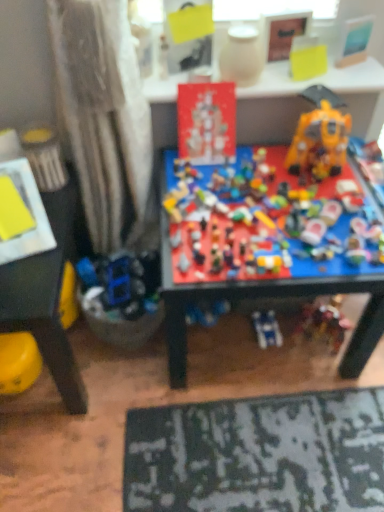
Question: Is multicolored plastic toys at center, which appears as the fourth toy when viewed from the left, to the left of yellow matte paper at upper center, positioned as the 5th toy in left-to-right order, from the viewer's perspective?

Choices:
 (A) no
 (B) yes

Answer: (B)

Question: Is multicolored plastic toys at center, which appears as the fourth toy when viewed from the left, bigger than yellow matte paper at upper center, positioned as the 5th toy in left-to-right order?

Choices:
 (A) no
 (B) yes

Answer: (B)

Question: Is the position of multicolored plastic toys at center, which appears as the fourth toy when viewed from the left, less distant than that of yellow matte paper at upper center, positioned as the 5th toy in left-to-right order?

Choices:
 (A) yes
 (B) no

Answer: (A)

Question: Is multicolored plastic toys at center, the 3th toy viewed from the right, looking in the opposite direction of yellow matte paper at upper center, positioned as the 5th toy in left-to-right order?

Choices:
 (A) no
 (B) yes

Answer: (A)

Question: Is multicolored plastic toys at center, which appears as the fourth toy when viewed from the left, positioned behind yellow matte paper at upper center, positioned as the 5th toy in left-to-right order?

Choices:
 (A) no
 (B) yes

Answer: (A)

Question: Does point (314, 48) appear closer or farther from the camera than point (360, 91)?

Choices:
 (A) farther
 (B) closer

Answer: (A)

Question: Based on their sizes in the image, would you say yellow matte paper at upper center, placed as the second toy when sorted from right to left, is bigger or smaller than red cardboard sign at upper center, which is the 1th table from right to left?

Choices:
 (A) big
 (B) small

Answer: (B)

Question: Is yellow matte paper at upper center, placed as the second toy when sorted from right to left, taller or shorter than red cardboard sign at upper center, the 2th table from the left?

Choices:
 (A) short
 (B) tall

Answer: (B)

Question: From the image's perspective, is yellow matte paper at upper center, placed as the second toy when sorted from right to left, above or below red cardboard sign at upper center, which is the 1th table from right to left?

Choices:
 (A) below
 (B) above

Answer: (B)

Question: From the image's perspective, is shiny yellow plastic robot at upper right, the 1th toy positioned from the right, located above or below yellow matte paper at upper center, positioned as the 5th toy in left-to-right order?

Choices:
 (A) below
 (B) above

Answer: (A)

Question: Based on their sizes in the image, would you say shiny yellow plastic robot at upper right, the 1th toy positioned from the right, is bigger or smaller than yellow matte paper at upper center, positioned as the 5th toy in left-to-right order?

Choices:
 (A) small
 (B) big

Answer: (B)

Question: Looking at their shapes, would you say shiny yellow plastic robot at upper right, acting as the sixth toy starting from the left, is wider or thinner than yellow matte paper at upper center, positioned as the 5th toy in left-to-right order?

Choices:
 (A) wide
 (B) thin

Answer: (A)

Question: From a real-world perspective, is shiny yellow plastic robot at upper right, the 1th toy positioned from the right, positioned above or below yellow matte paper at upper center, placed as the second toy when sorted from right to left?

Choices:
 (A) below
 (B) above

Answer: (A)

Question: Is point (69, 236) closer or farther from the camera than point (36, 162)?

Choices:
 (A) closer
 (B) farther

Answer: (B)

Question: From their relative heights in the image, would you say yellow plastic toy at lower left, which appears as the first table when ordered from the bottom, is taller or shorter than metallic yellow can at left, the 6th toy viewed from the right?

Choices:
 (A) short
 (B) tall

Answer: (B)